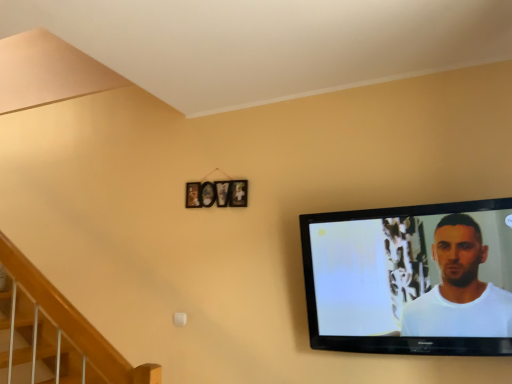
Question: Considering the positions of wooden picture frame at center and black glossy tv at right in the image, is wooden picture frame at center taller or shorter than black glossy tv at right?

Choices:
 (A) short
 (B) tall

Answer: (A)

Question: From a real-world perspective, relative to black glossy tv at right, is wooden picture frame at center vertically above or below?

Choices:
 (A) below
 (B) above

Answer: (B)

Question: From the image's perspective, is wooden picture frame at center above or below black glossy tv at right?

Choices:
 (A) below
 (B) above

Answer: (B)

Question: Relative to wooden picture frame at center, is black glossy tv at right in front or behind?

Choices:
 (A) front
 (B) behind

Answer: (A)

Question: Which is correct: black glossy tv at right is inside wooden picture frame at center, or outside of it?

Choices:
 (A) inside
 (B) outside

Answer: (B)

Question: Is black glossy tv at right to the left or to the right of wooden picture frame at center in the image?

Choices:
 (A) left
 (B) right

Answer: (B)

Question: Considering the positions of point (437, 278) and point (218, 183), is point (437, 278) closer or farther from the camera than point (218, 183)?

Choices:
 (A) farther
 (B) closer

Answer: (B)